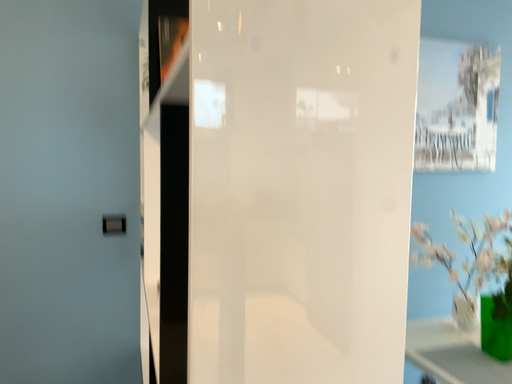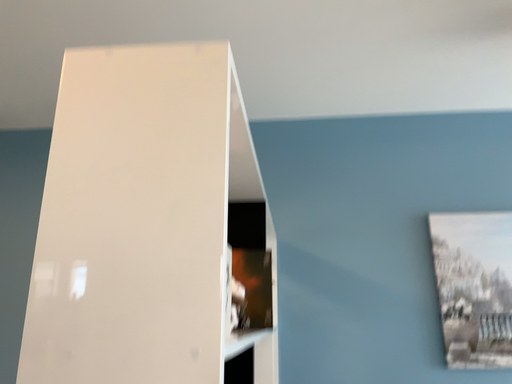
Question: How did the camera likely rotate when shooting the video?

Choices:
 (A) rotated upward
 (B) rotated downward

Answer: (A)